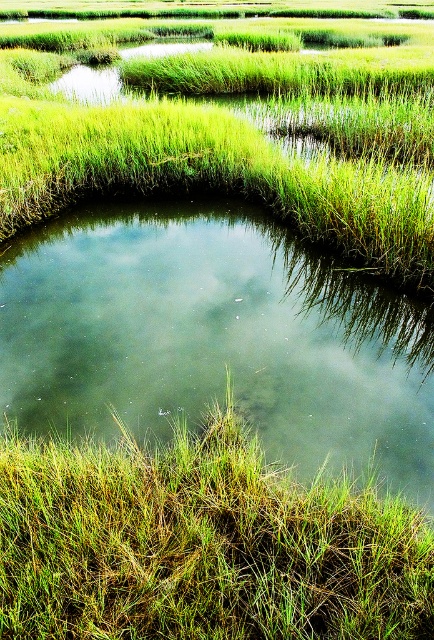
Between green grassy pond at center and green grassy at lower left, which one is positioned higher?

Positioned higher is green grassy pond at center.

Does point (141, 227) come closer to viewer compared to point (102, 564)?

That is False.

Is point (430, 500) closer to viewer compared to point (319, 586)?

No, it is behind (319, 586).

This screenshot has width=434, height=640. Find the location of `green grassy pond at center`. green grassy pond at center is located at coordinates (216, 339).